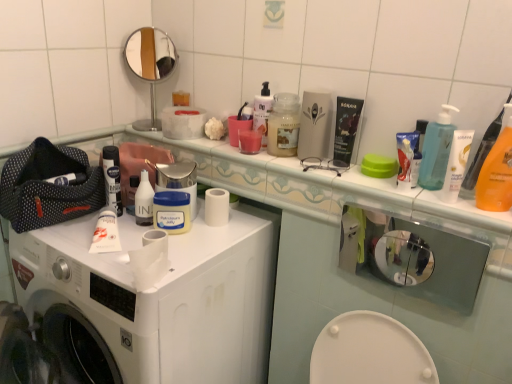
I want to click on free area in between translucent plastic jar at center, the first mouthwash from the right, and metallic silver glasses at upper center, so click(x=303, y=167).